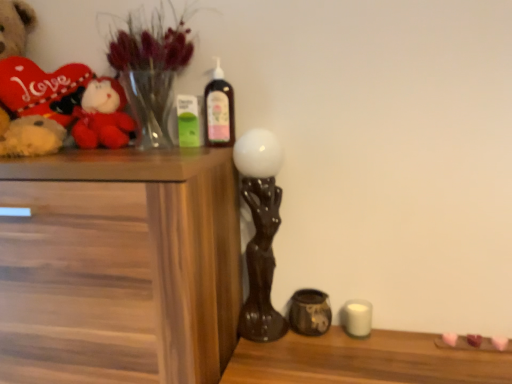
Question: From a real-world perspective, is matte black sculpture at center, placed as the 1th candle holder when sorted from left to right, positioned above or below translucent glass vase at upper left?

Choices:
 (A) above
 (B) below

Answer: (B)

Question: Based on their sizes in the image, would you say matte black sculpture at center, the second candle holder from the right, is bigger or smaller than translucent glass vase at upper left?

Choices:
 (A) big
 (B) small

Answer: (A)

Question: Which object is positioned farthest from the translucent plastic bottle at upper center?

Choices:
 (A) velvet plush toy at left
 (B) matte black sculpture at center, the second candle holder from the right
 (C) wooden chest of drawers at left
 (D) matte brown ceramic jar at lower center, the 1th candle holder from the right
 (E) white matte candle at lower right

Answer: (E)

Question: Which of these objects is positioned farthest from the matte brown ceramic jar at lower center, the 1th candle holder from the right?

Choices:
 (A) white matte candle at lower right
 (B) velvet plush toy at left
 (C) wooden chest of drawers at left
 (D) matte black sculpture at center, the second candle holder from the right
 (E) translucent glass vase at upper left

Answer: (E)